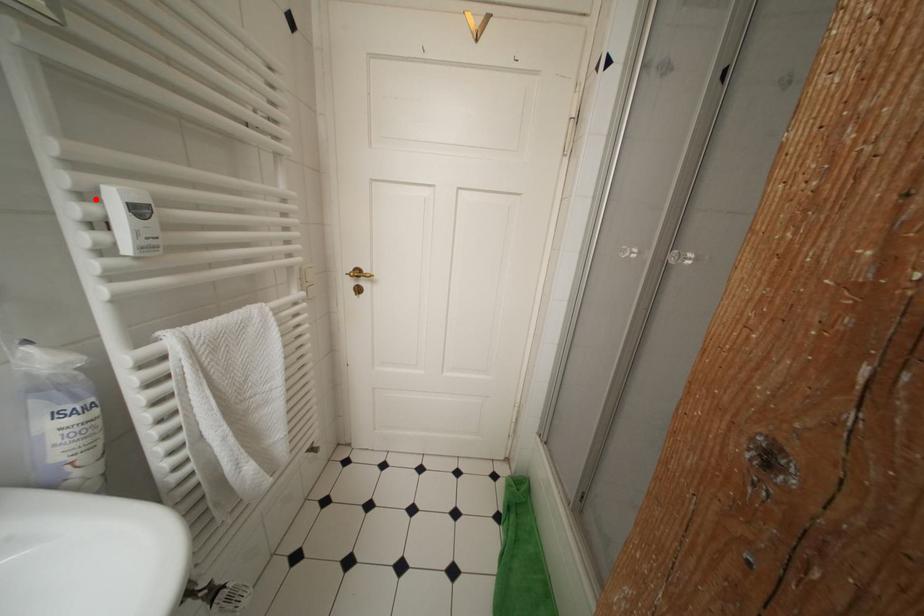
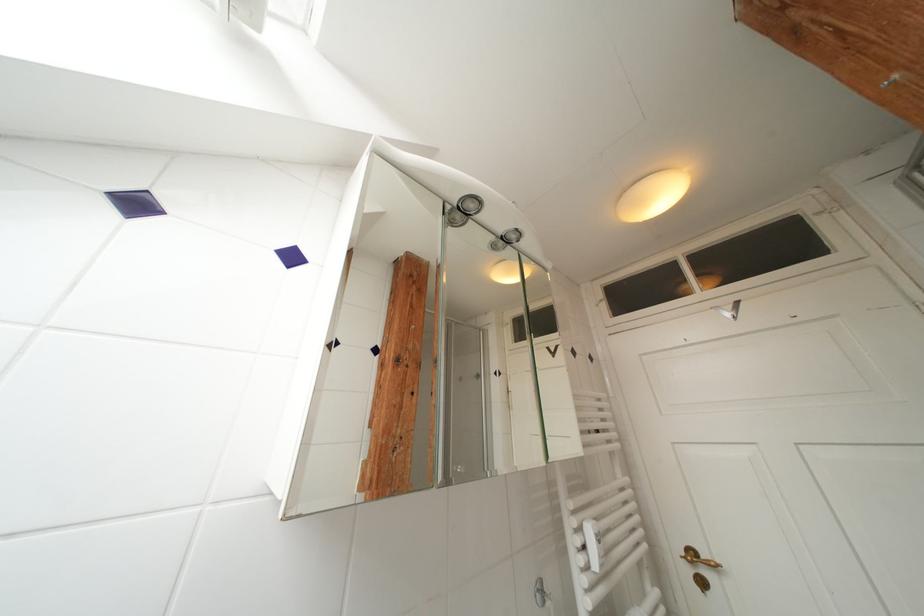
Find the pixel in the second image that matches the highlighted location in the first image.

(586, 533)